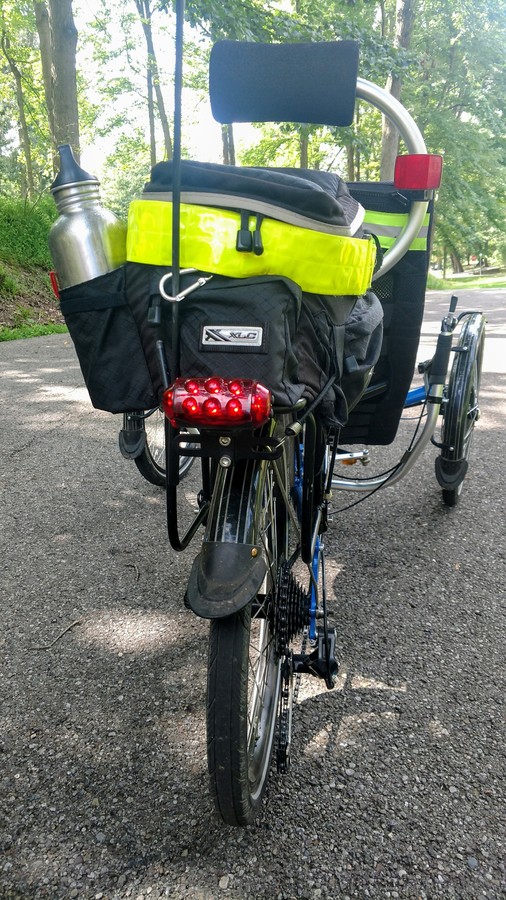
Where is `screws`? The width and height of the screenshot is (506, 900). screws is located at coordinates (224, 441), (223, 462).